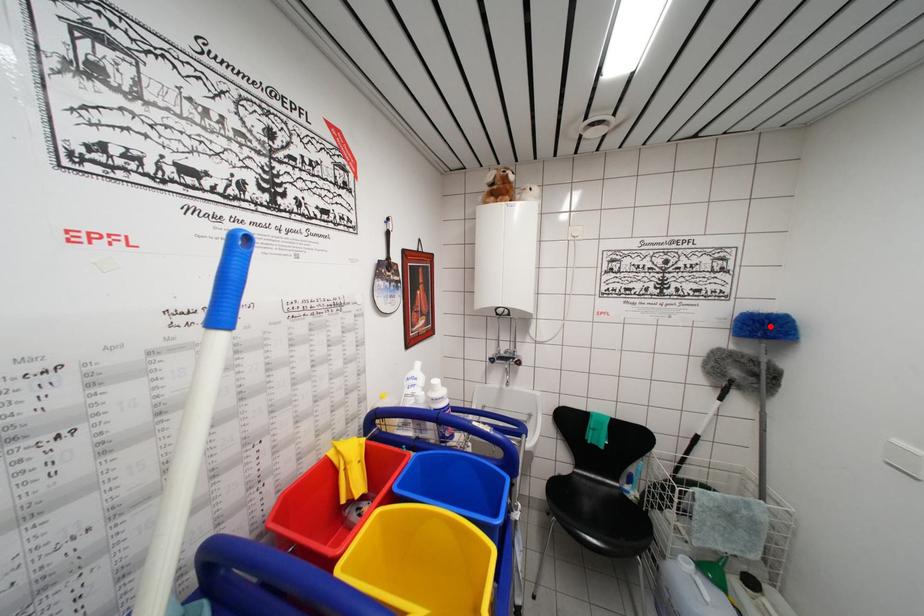
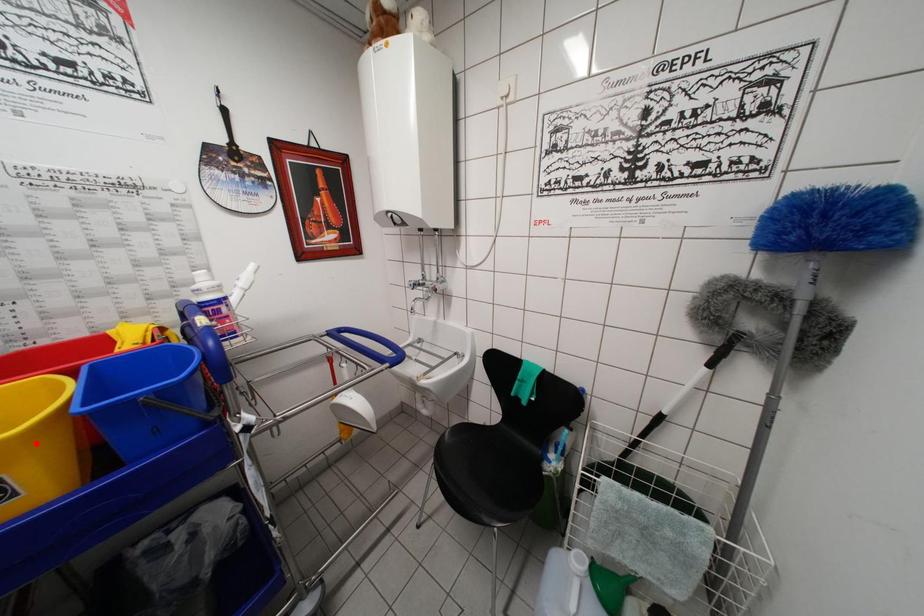
I am providing you with two images of the same scene from different viewpoints. A red point is marked on the first image and another point is marked on the second image. Is the red point in image1 aligned with the point shown in image2?

No